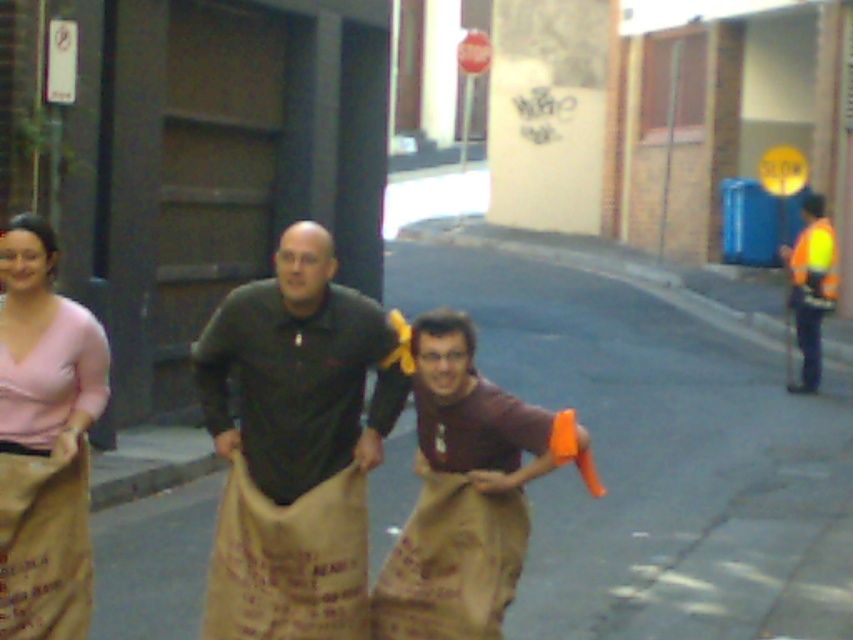
You are a photographer trying to capture the sack race participants. You notice the burlap sack at center and the matte pink sweater at left. Which object should you focus on if you want to photograph something closer to the camera?

The burlap sack at center is shorter than the matte pink sweater at left, so it is closer to the camera. Therefore, focusing on the burlap sack at center will capture the closer object.